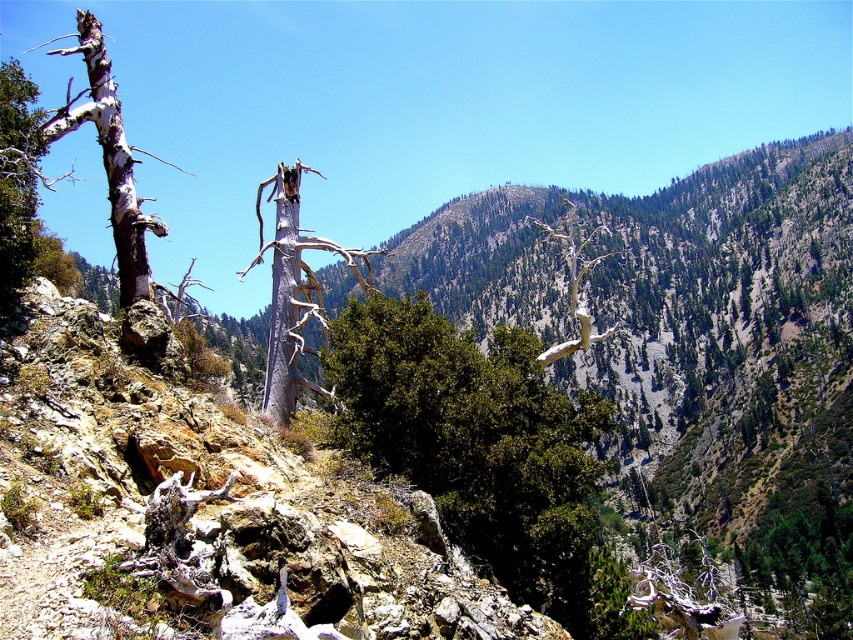
Is point (540, 488) closer to viewer compared to point (117, 237)?

Yes, it is in front of point (117, 237).

Can you confirm if green leafy bush at center is smaller than gray bark tree at left?

Yes.

Between point (480, 380) and point (152, 298), which one is positioned behind?

The point (480, 380) is behind.

Find the location of a particular element. green leafy bush at center is located at coordinates (474, 436).

Locate an element on the screen. gray bark tree at center is located at coordinates (294, 291).

Between point (287, 285) and point (102, 99), which one is positioned in front?

Positioned in front is point (102, 99).

Which is behind, point (302, 237) or point (100, 113)?

The point (302, 237) is behind.

Find the location of a particular element. The height and width of the screenshot is (640, 853). gray bark tree at center is located at coordinates (294, 291).

In the scene shown: Which of these two, green leafy bush at center or gray bark tree at center, stands shorter?

green leafy bush at center

Who is taller, green leafy bush at center or gray bark tree at center?

Standing taller between the two is gray bark tree at center.

Is point (556, 477) positioned behind point (286, 189)?

No, it is not.

Where is `green leafy bush at center`? This screenshot has width=853, height=640. green leafy bush at center is located at coordinates (474, 436).